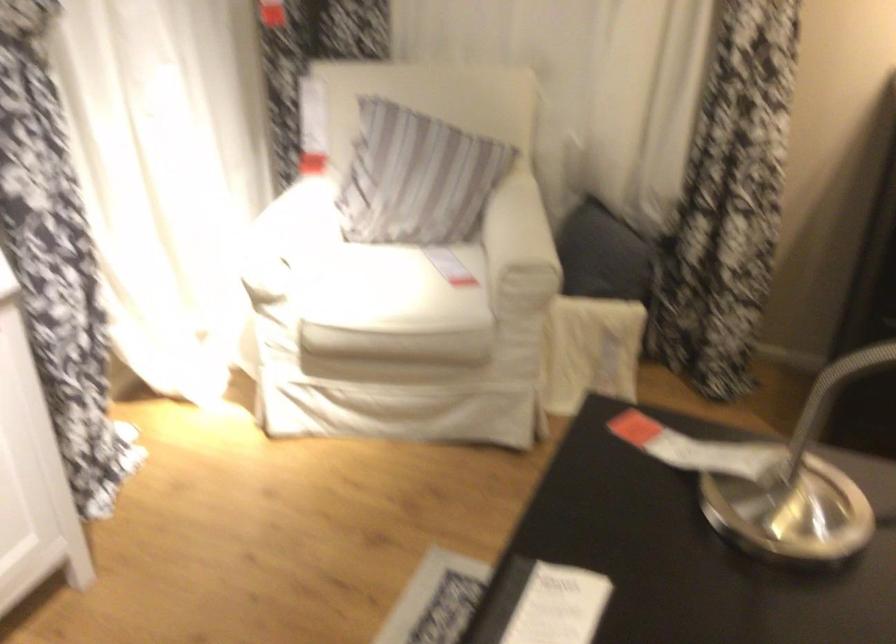
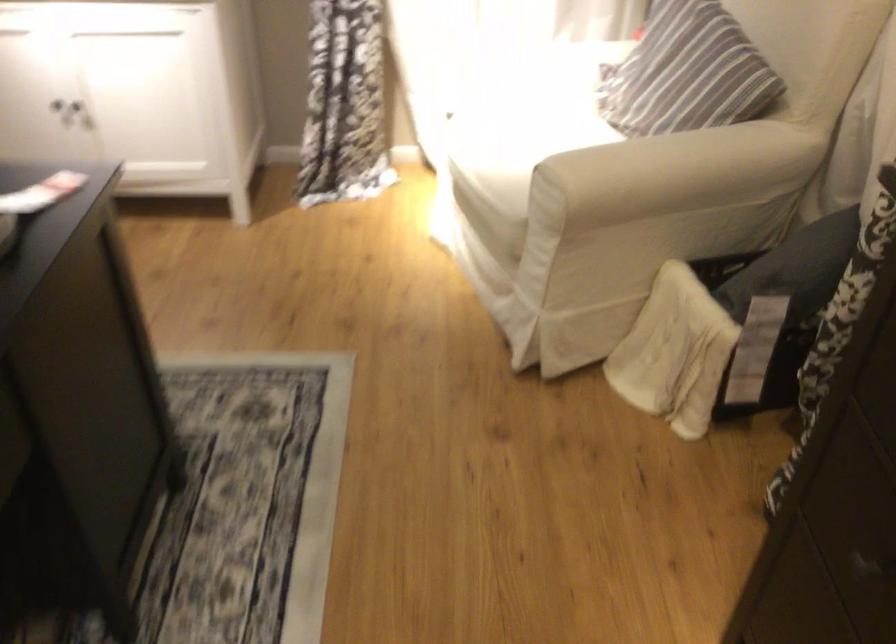
Where in the second image is the point corresponding to (x=328, y=267) from the first image?

(527, 114)